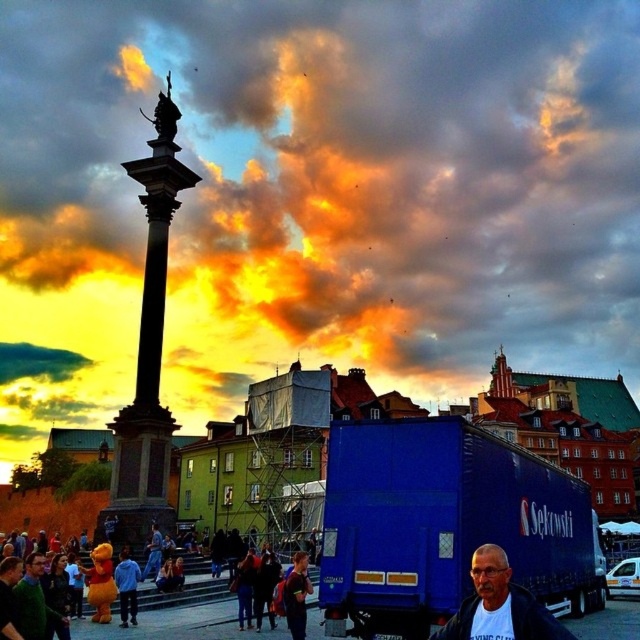
The image size is (640, 640). In order to click on cloudy sky at upper center in this screenshot , I will do `click(330, 184)`.

Is cloudy sky at upper center to the right of gray fabric jacket at lower right from the viewer's perspective?

No, cloudy sky at upper center is not to the right of gray fabric jacket at lower right.

Is cloudy sky at upper center positioned at the back of gray fabric jacket at lower right?

Yes, cloudy sky at upper center is behind gray fabric jacket at lower right.

Which is behind, point (108, 76) or point (540, 625)?

The point (108, 76) is more distant.

This screenshot has height=640, width=640. I want to click on cloudy sky at upper center, so click(x=330, y=184).

Which is behind, point (125, 532) or point (116, 618)?

The point (125, 532) is behind.

Is dark gray stone column at center wider than yellow plush bear at lower left?

Yes.

Which is behind, point (161, 496) or point (195, 620)?

The point (161, 496) is behind.

This screenshot has width=640, height=640. Identify the location of dark gray stone column at center. (147, 355).